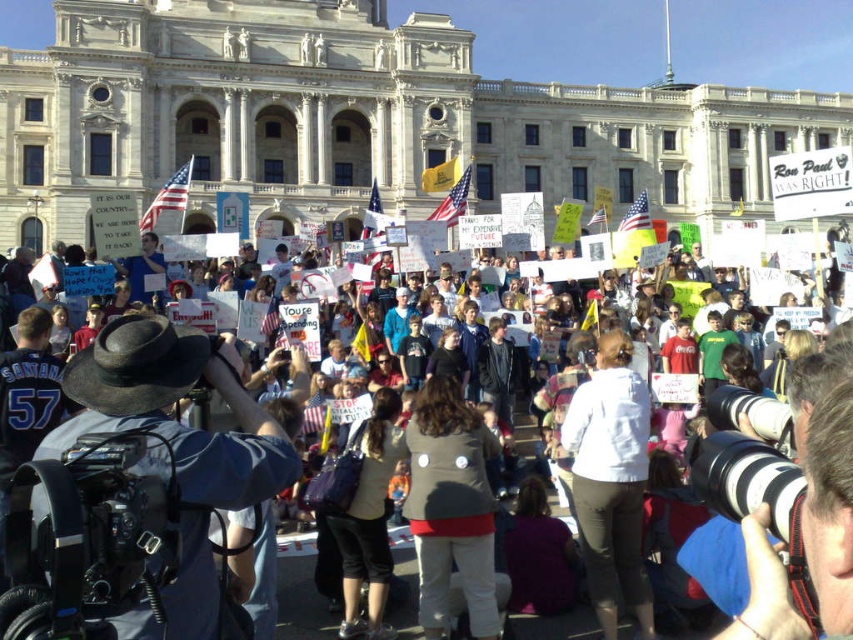
Question: Does gray fabric jacket at center lie behind white paper signs at center?

Choices:
 (A) no
 (B) yes

Answer: (B)

Question: Which object is the farthest from the denim jacket at lower left?

Choices:
 (A) gray fabric jacket at center
 (B) white matte shirt at center

Answer: (B)

Question: Which point is farther from the camera taking this photo?

Choices:
 (A) (439, 420)
 (B) (824, 433)
 (C) (625, 381)
 (D) (265, 481)

Answer: (C)

Question: Considering the relative positions of white matte shirt at center and matte brown jacket at center in the image provided, where is white matte shirt at center located with respect to matte brown jacket at center?

Choices:
 (A) below
 (B) above

Answer: (B)

Question: Which point is closer to the camera taking this photo?

Choices:
 (A) (376, 513)
 (B) (268, 492)
 (C) (612, 620)

Answer: (B)

Question: Is denim jacket at lower left thinner than white paper signs at center?

Choices:
 (A) no
 (B) yes

Answer: (B)